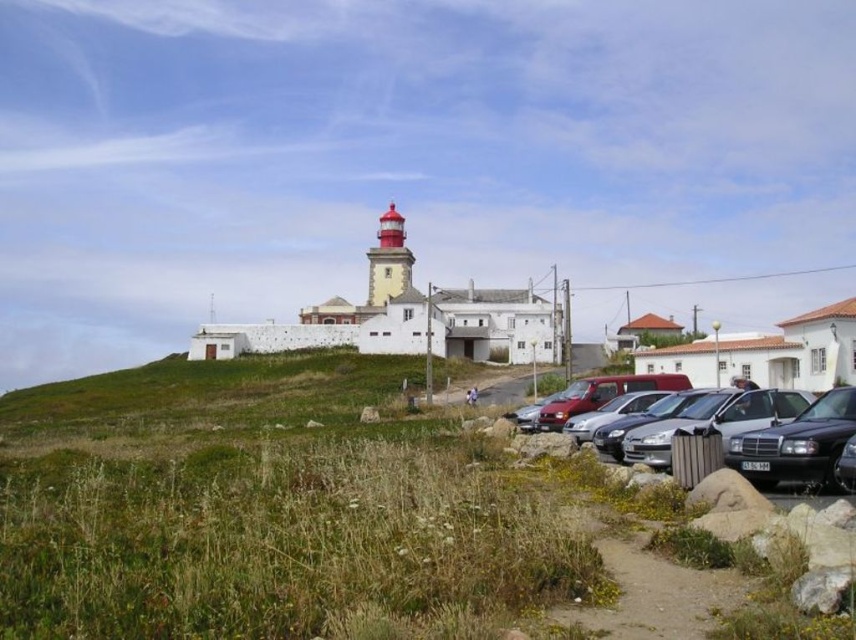
Question: Can you confirm if metallic silver car at center is bigger than shiny black sedan at lower right?

Choices:
 (A) yes
 (B) no

Answer: (A)

Question: Which object is closer to the camera taking this photo?

Choices:
 (A) green grass at lower left
 (B) metallic silver car at center
 (C) smooth yellow lighthouse at center

Answer: (A)

Question: Which of these objects is positioned farthest from the metallic silver car at center?

Choices:
 (A) smooth yellow lighthouse at center
 (B) shiny black sedan at lower right
 (C) green grass at lower left

Answer: (A)

Question: Which of the following is the farthest from the observer?

Choices:
 (A) (816, 416)
 (B) (379, 291)
 (C) (165, 394)

Answer: (B)

Question: Is green grass at lower left to the right of metallic silver car at center from the viewer's perspective?

Choices:
 (A) no
 (B) yes

Answer: (A)

Question: Does shiny black sedan at lower right have a larger size compared to smooth yellow lighthouse at center?

Choices:
 (A) no
 (B) yes

Answer: (A)